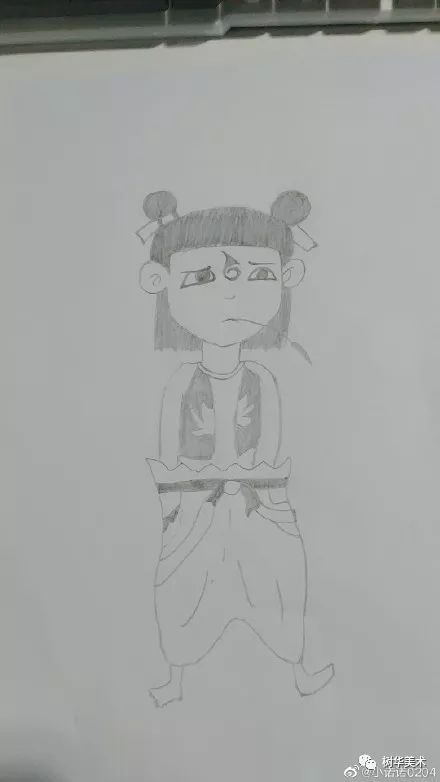
You are a GUI agent. You are given a task and a screenshot of the screen. Output one action in this format:
    pyautogui.click(x=<x>, y=<y>)
    Task: Click on the robe
    
    Given the screenshot: What is the action you would take?
    pyautogui.click(x=171, y=540)